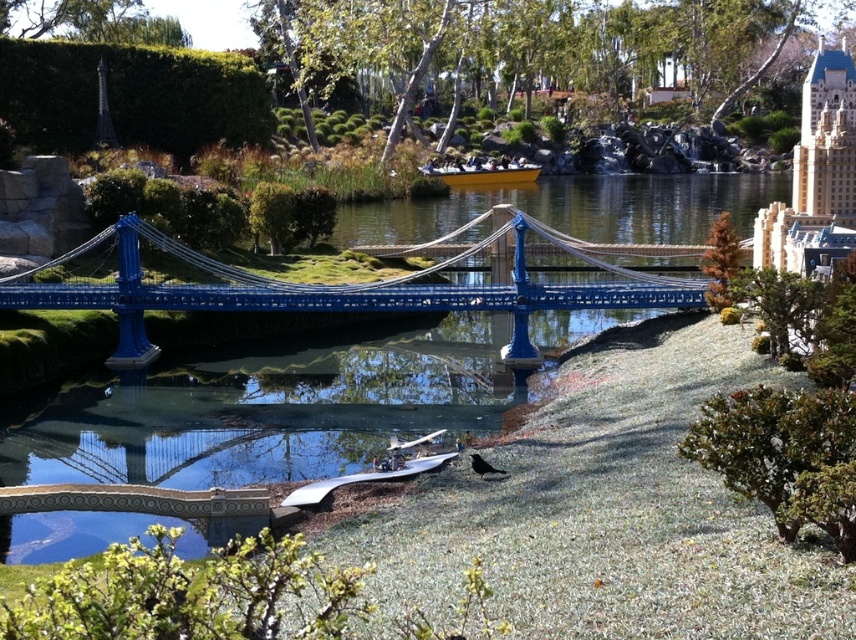
Consider the image. You are a visitor at the miniature park and want to take a photo of the metallic blue bridge at center and the yellow matte boat at center. Which object is positioned lower in the image?

The metallic blue bridge at center is positioned below the yellow matte boat at center, so it is lower in the image.

Based on the photo, you are standing in front of the miniature landscape scene. You notice two points marked in the image. Which point, point [43,284] or point [447,168], is closer to you?

Point [43,284] is closer to the viewer than point [447,168].